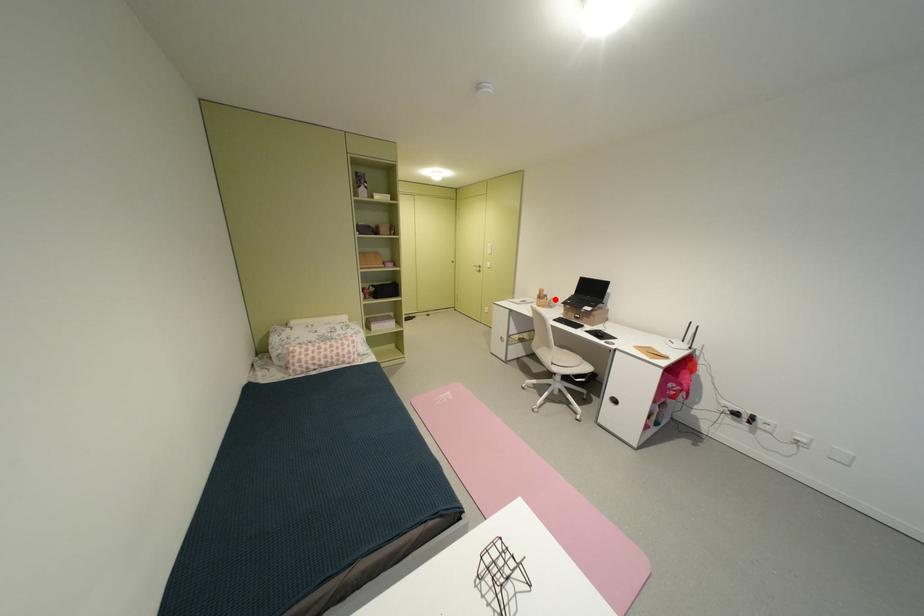
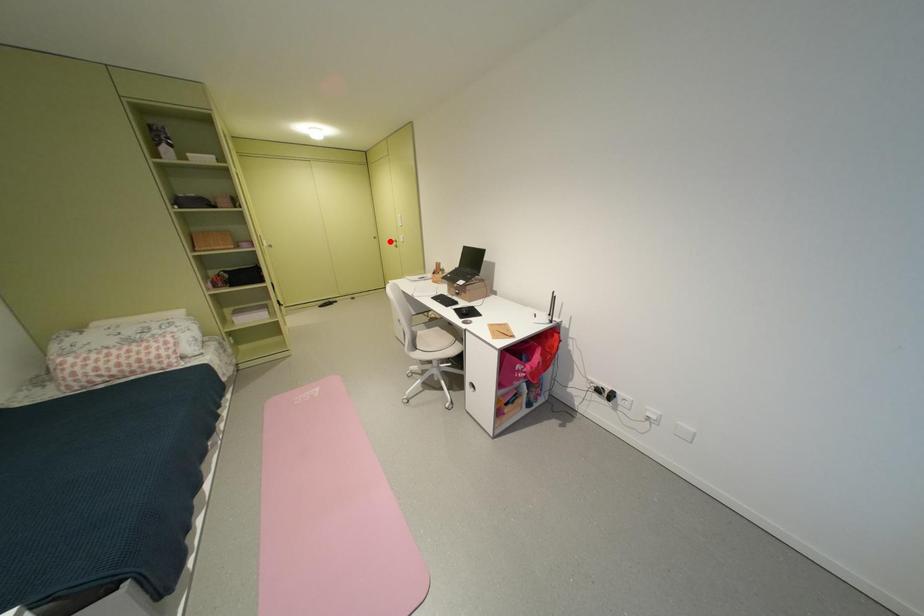
I am providing you with two images of the same scene from different viewpoints. A red point is marked on the first image and another point is marked on the second image. Do the highlighted points in image1 and image2 indicate the same real-world spot?

No